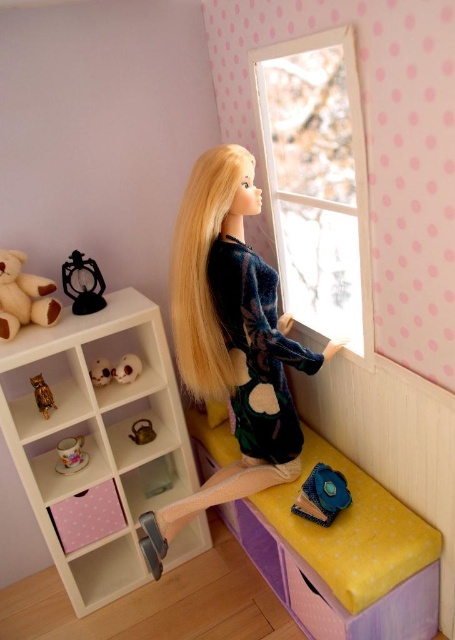
Question: Which point is closer to the camera taking this photo?

Choices:
 (A) (273, 348)
 (B) (274, 48)
 (C) (134, 413)
 (D) (39, 380)

Answer: (A)

Question: Does faded denim jacket at lower right have a greater width compared to shiny gold owl at left?

Choices:
 (A) yes
 (B) no

Answer: (A)

Question: Based on their relative distances, which object is farther from the white plush toy at upper left?

Choices:
 (A) soft brown plush bear at upper left
 (B) yellow fabric stool at lower center
 (C) metallic clock at upper left

Answer: (B)

Question: Is yellow fabric stool at lower center smaller than faded denim jacket at lower right?

Choices:
 (A) no
 (B) yes

Answer: (A)

Question: Which of the following is the closest to the observer?

Choices:
 (A) (101, 356)
 (B) (96, 593)
 (C) (350, 125)

Answer: (C)

Question: Is yellow fabric stool at lower center bigger than soft brown plush bear at upper left?

Choices:
 (A) no
 (B) yes

Answer: (B)